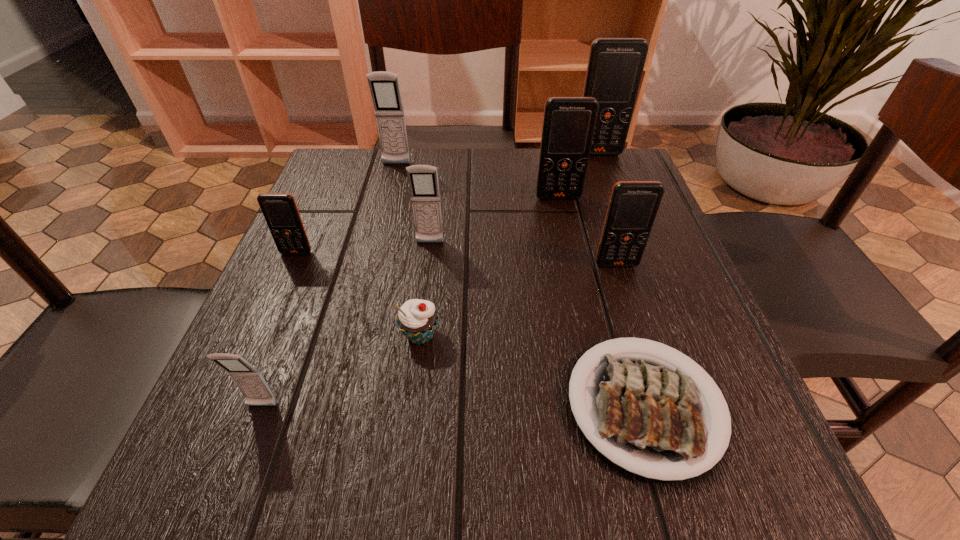
You are a GUI agent. You are given a task and a screenshot of the screen. Output one action in this format:
    pyautogui.click(x=<x>, y=<y>)
    Task: Click on the tallest cellular telephone
    The height and width of the screenshot is (540, 960).
    Given the screenshot: What is the action you would take?
    (615, 66)

At what (x,y) coordinates should I click in order to perform the action: click on the farthest object. Please return your answer as a coordinate pair (x, y). This screenshot has width=960, height=540. Looking at the image, I should click on (615, 66).

Locate an element on the screen. Image resolution: width=960 pixels, height=540 pixels. the second farthest object is located at coordinates (384, 86).

I want to click on the third object from left to right, so click(x=384, y=86).

Identify the location of the third smallest orange cellular telephone. The image size is (960, 540). (569, 123).

In order to click on the seventh nearest object in this screenshot , I will do `click(569, 123)`.

Where is `the sixth nearest object`? the sixth nearest object is located at coordinates (423, 180).

At what (x,y) coordinates should I click in order to perform the action: click on the fourth cellular telephone from right to left. Please return your answer as a coordinate pair (x, y). This screenshot has height=540, width=960. Looking at the image, I should click on (423, 180).

The height and width of the screenshot is (540, 960). In order to click on the fourth nearest object in this screenshot , I will do `click(633, 206)`.

Locate an element on the screen. This screenshot has height=540, width=960. the nearest orange cellular telephone is located at coordinates (633, 206).